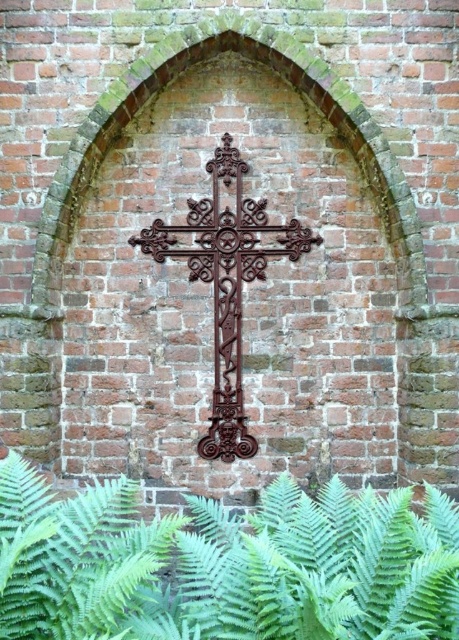
You are standing in front of the brick wall with an arched opening. You see a green leafy fern at lower center and a rusty metal cross at center. Which object is positioned lower on the wall?

The green leafy fern at lower center is positioned lower on the wall than the rusty metal cross at center.